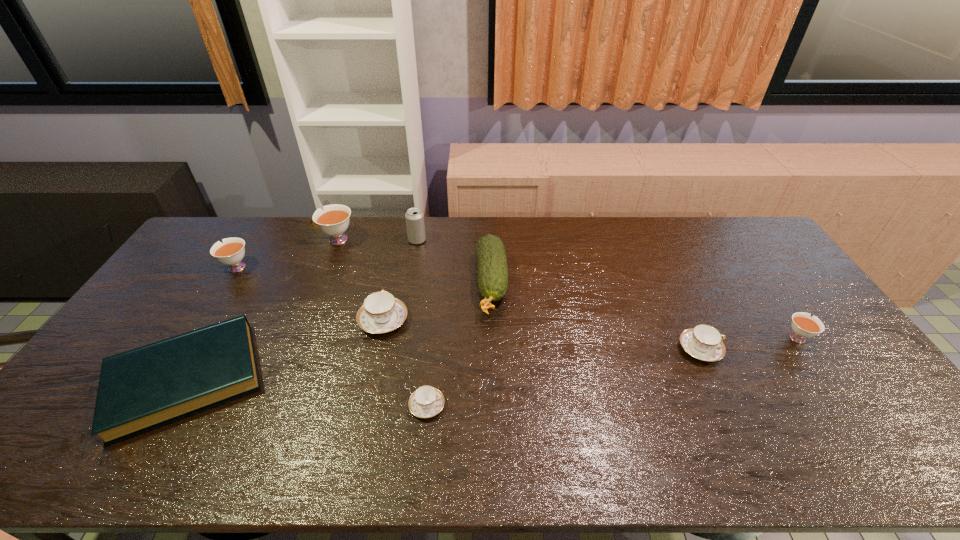
The image size is (960, 540). I want to click on free space located 0.110m on the side with the handle of the nearest blue teacup, so click(x=489, y=406).

Where is `beer can that is at the far edge`? The image size is (960, 540). beer can that is at the far edge is located at coordinates (414, 217).

Where is `teacup located in the far edge section of the desktop`? The height and width of the screenshot is (540, 960). teacup located in the far edge section of the desktop is located at coordinates (334, 220).

Identify the location of cucumber present at the far edge. (492, 265).

Locate an element on the screen. The image size is (960, 540). object present at the near edge is located at coordinates (147, 387).

Find the location of a particular element. This screenshot has width=960, height=540. teacup that is at the left edge is located at coordinates (230, 252).

The image size is (960, 540). In order to click on book that is positioned at the left edge in this screenshot , I will do `click(147, 387)`.

This screenshot has width=960, height=540. What are the coordinates of `object situated at the right edge` in the screenshot? It's located at (804, 326).

This screenshot has width=960, height=540. I want to click on object positioned at the near left corner, so 147,387.

The width and height of the screenshot is (960, 540). I want to click on free spot at the far edge of the desktop, so click(x=587, y=220).